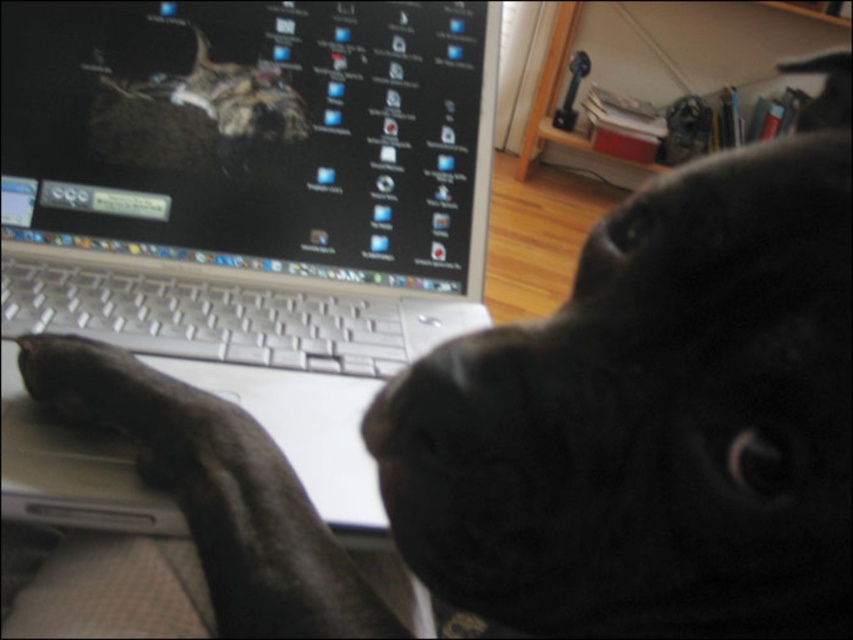
Question: Is silver metallic laptop at center positioned in front of silver metallic keyboard at center?

Choices:
 (A) no
 (B) yes

Answer: (B)

Question: Which object is positioned closest to the silver metallic keyboard at center?

Choices:
 (A) silver metallic laptop at center
 (B) black matte nose at center

Answer: (A)

Question: Which point is farther to the camera?

Choices:
 (A) silver metallic laptop at center
 (B) black matte nose at center
 (C) silver metallic keyboard at center

Answer: (C)

Question: Where is silver metallic keyboard at center located in relation to black matte nose at center in the image?

Choices:
 (A) right
 (B) left

Answer: (B)

Question: Observing the image, what is the correct spatial positioning of silver metallic keyboard at center in reference to black matte nose at center?

Choices:
 (A) right
 (B) left

Answer: (B)

Question: Among these objects, which one is farthest from the camera?

Choices:
 (A) silver metallic laptop at center
 (B) black matte nose at center
 (C) silver metallic keyboard at center

Answer: (C)